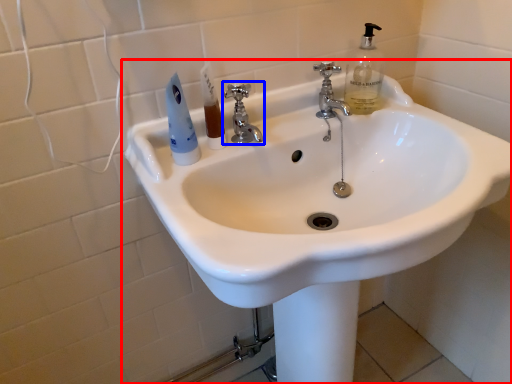
Question: Which of the following is the closest to the observer, sink (highlighted by a red box) or tap (highlighted by a blue box)?

Choices:
 (A) sink
 (B) tap

Answer: (A)